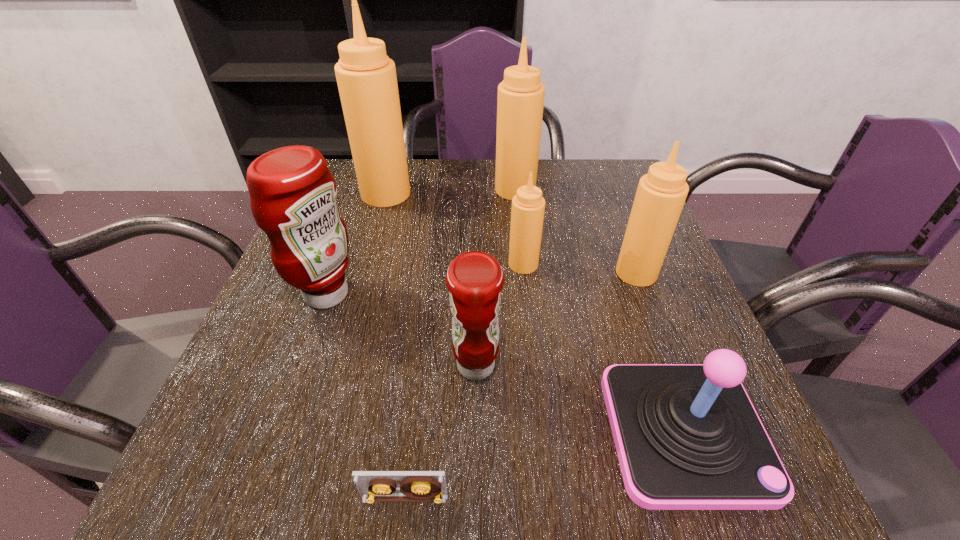
Where is `the nearer red condiment`? The height and width of the screenshot is (540, 960). the nearer red condiment is located at coordinates (474, 279).

Find the location of `joystick`. joystick is located at coordinates (687, 436).

The height and width of the screenshot is (540, 960). I want to click on the seventh tallest object, so click(x=687, y=436).

Locate an element on the screen. videotape is located at coordinates (373, 486).

This screenshot has width=960, height=540. In order to click on brown videotape in this screenshot , I will do `click(373, 486)`.

Where is `free location located on the right of the biggest tan condiment`? This screenshot has height=540, width=960. free location located on the right of the biggest tan condiment is located at coordinates (433, 194).

I want to click on vacant space located on the right of the second tallest object, so click(617, 190).

Where is `free location located on the front of the rightmost condiment`? The height and width of the screenshot is (540, 960). free location located on the front of the rightmost condiment is located at coordinates (671, 362).

At what (x,y) coordinates should I click in order to perform the action: click on vacant region located 0.090m on the right of the farther red condiment. Please return your answer as a coordinate pair (x, y). Looking at the image, I should click on (400, 294).

I want to click on vacant space located on the back of the smallest tan condiment, so click(x=515, y=186).